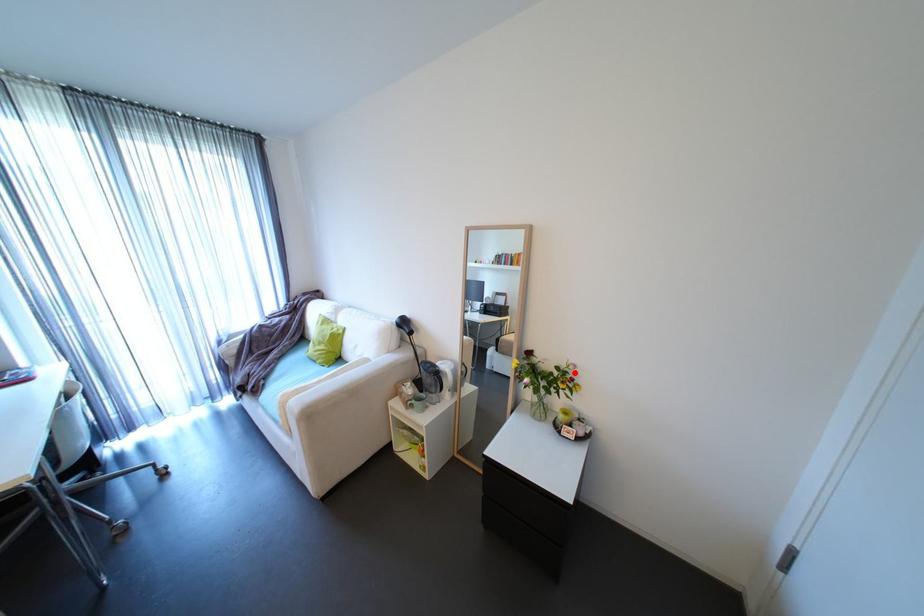
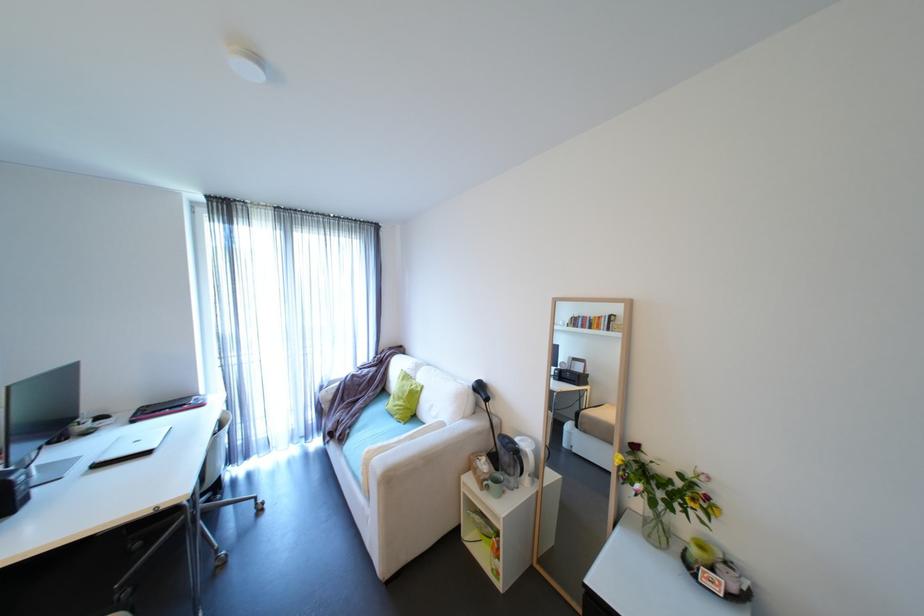
In the second image, find the point that corresponds to the highlighted location in the first image.

(703, 485)